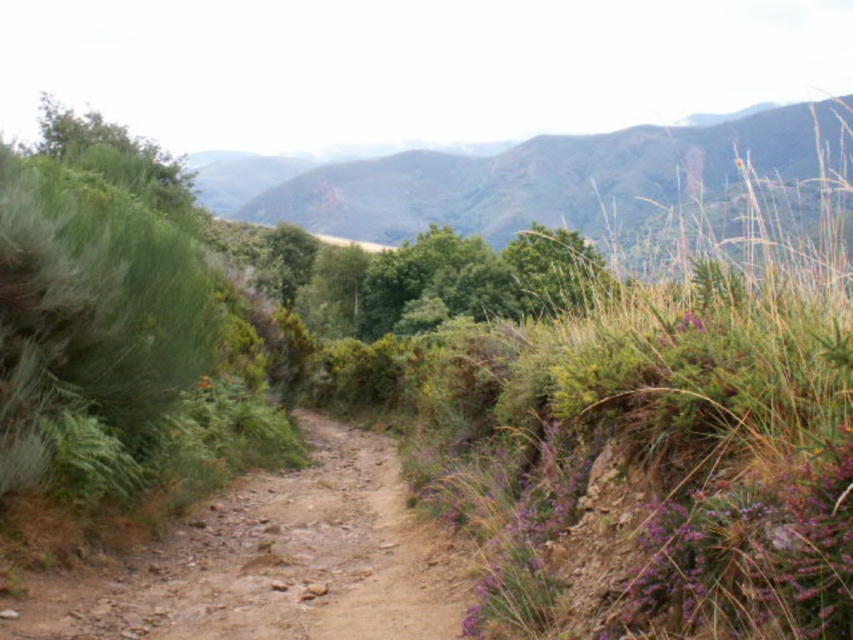
Does point (431, 541) come farther from viewer compared to point (534, 264)?

No, it is not.

Does brown dirt track at center lie in front of green leafy tree at center?

That is True.

Who is more forward, (369, 598) or (529, 248)?

Point (369, 598)

This screenshot has width=853, height=640. What are the coordinates of `brown dirt track at center` in the screenshot? It's located at (271, 563).